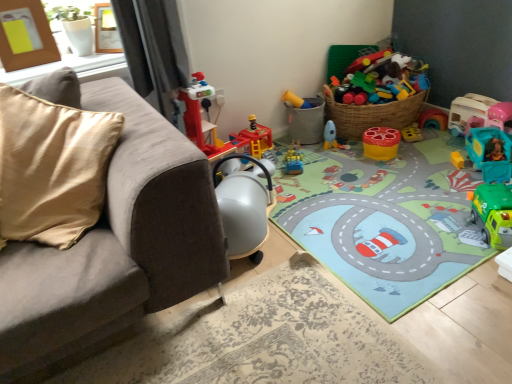
Question: Does wooden photo frame at upper center, positioned as the 2th picture frame in left-to-right order, have a lesser height compared to teal plastic toy car at right, placed as the fifth toy when sorted from left to right?

Choices:
 (A) yes
 (B) no

Answer: (B)

Question: Considering the relative sizes of wooden photo frame at upper center, positioned as the 2th picture frame in left-to-right order, and teal plastic toy car at right, placed as the fifth toy when sorted from left to right, in the image provided, is wooden photo frame at upper center, positioned as the 2th picture frame in left-to-right order, smaller than teal plastic toy car at right, placed as the fifth toy when sorted from left to right,?

Choices:
 (A) no
 (B) yes

Answer: (B)

Question: Is wooden photo frame at upper center, positioned as the first picture frame in right-to-left order, positioned behind teal plastic toy car at right, placed as the fifth toy when sorted from left to right?

Choices:
 (A) no
 (B) yes

Answer: (A)

Question: From a real-world perspective, is wooden photo frame at upper center, positioned as the first picture frame in right-to-left order, located higher than teal plastic toy car at right, placed as the second toy when sorted from right to left?

Choices:
 (A) no
 (B) yes

Answer: (B)

Question: Does wooden photo frame at upper center, positioned as the 2th picture frame in left-to-right order, have a lesser width compared to teal plastic toy car at right, placed as the second toy when sorted from right to left?

Choices:
 (A) yes
 (B) no

Answer: (A)

Question: Looking at the image, does suede gray couch at left seem bigger or smaller compared to brown wooden picture frame at upper left, the 1th picture frame from the left?

Choices:
 (A) big
 (B) small

Answer: (A)

Question: Is point (125, 322) positioned closer to the camera than point (37, 6)?

Choices:
 (A) farther
 (B) closer

Answer: (B)

Question: In terms of height, does suede gray couch at left look taller or shorter compared to brown wooden picture frame at upper left, the 2th picture frame positioned from the right?

Choices:
 (A) tall
 (B) short

Answer: (A)

Question: Based on their positions, is suede gray couch at left located to the left or right of brown wooden picture frame at upper left, the 2th picture frame positioned from the right?

Choices:
 (A) left
 (B) right

Answer: (B)

Question: From a real-world perspective, is yellow matte stool at center, arranged as the 3th toy when viewed from the left, above or below suede gray couch at left?

Choices:
 (A) above
 (B) below

Answer: (B)

Question: Considering the relative positions of yellow matte stool at center, placed as the fourth toy when sorted from right to left, and suede gray couch at left in the image provided, is yellow matte stool at center, placed as the fourth toy when sorted from right to left, to the left or to the right of suede gray couch at left?

Choices:
 (A) left
 (B) right

Answer: (B)

Question: Is yellow matte stool at center, arranged as the 3th toy when viewed from the left, bigger or smaller than suede gray couch at left?

Choices:
 (A) small
 (B) big

Answer: (A)

Question: Is yellow matte stool at center, placed as the fourth toy when sorted from right to left, inside the boundaries of suede gray couch at left, or outside?

Choices:
 (A) outside
 (B) inside

Answer: (A)

Question: From a real-world perspective, is teal plastic toy car at right, placed as the fifth toy when sorted from left to right, above or below yellow matte stool at center, arranged as the 3th toy when viewed from the left?

Choices:
 (A) below
 (B) above

Answer: (B)

Question: Based on their positions, is teal plastic toy car at right, placed as the second toy when sorted from right to left, located to the left or right of yellow matte stool at center, arranged as the 3th toy when viewed from the left?

Choices:
 (A) left
 (B) right

Answer: (B)